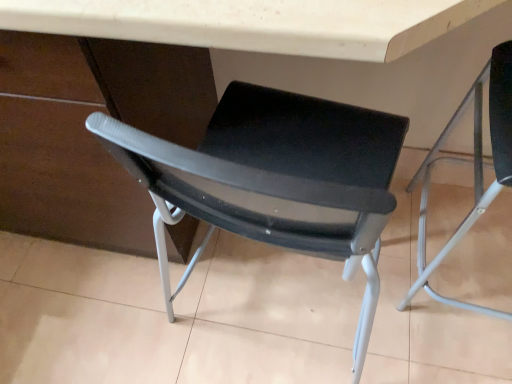
Describe the element at coordinates (474, 168) in the screenshot. I see `matte black chair at right, the first chair when ordered from right to left` at that location.

At what (x,y) coordinates should I click in order to perform the action: click on black mesh chair at center, which appears as the 1th chair when viewed from the left. Please return your answer as a coordinate pair (x, y). This screenshot has height=384, width=512. Looking at the image, I should click on (275, 180).

Locate an element on the screen. This screenshot has width=512, height=384. matte black chair at right, the first chair when ordered from right to left is located at coordinates (474, 168).

Is matte plastic table at center facing away from matte black chair at right, acting as the 2th chair starting from the left?

No, matte plastic table at center is not facing the opposite direction of matte black chair at right, acting as the 2th chair starting from the left.

Based on the photo, between matte plastic table at center and matte black chair at right, acting as the 2th chair starting from the left, which one has larger width?

matte plastic table at center is wider.

Would you say matte plastic table at center is inside or outside matte black chair at right, acting as the 2th chair starting from the left?

matte plastic table at center is spatially situated outside matte black chair at right, acting as the 2th chair starting from the left.

Who is smaller, matte plastic table at center or black mesh chair at center, which appears as the 1th chair when viewed from the left?

With smaller size is black mesh chair at center, which appears as the 1th chair when viewed from the left.

Is matte plastic table at center taller than black mesh chair at center, marked as the second chair in a right-to-left arrangement?

Indeed, matte plastic table at center has a greater height compared to black mesh chair at center, marked as the second chair in a right-to-left arrangement.

Between matte plastic table at center and black mesh chair at center, which appears as the 1th chair when viewed from the left, which one has smaller width?

matte plastic table at center.

From the image's perspective, is matte plastic table at center below black mesh chair at center, marked as the second chair in a right-to-left arrangement?

No, from the image's perspective, matte plastic table at center is not below black mesh chair at center, marked as the second chair in a right-to-left arrangement.

Is matte black chair at right, acting as the 2th chair starting from the left, smaller than black mesh chair at center, which appears as the 1th chair when viewed from the left?

Incorrect, matte black chair at right, acting as the 2th chair starting from the left, is not smaller in size than black mesh chair at center, which appears as the 1th chair when viewed from the left.

Is matte black chair at right, the first chair when ordered from right to left, turned away from black mesh chair at center, marked as the second chair in a right-to-left arrangement?

No, matte black chair at right, the first chair when ordered from right to left, is not facing the opposite direction of black mesh chair at center, marked as the second chair in a right-to-left arrangement.

Which object is further away from the camera, matte black chair at right, acting as the 2th chair starting from the left, or black mesh chair at center, marked as the second chair in a right-to-left arrangement?

black mesh chair at center, marked as the second chair in a right-to-left arrangement, is behind.

From the image's perspective, which is below, matte black chair at right, acting as the 2th chair starting from the left, or black mesh chair at center, which appears as the 1th chair when viewed from the left?

black mesh chair at center, which appears as the 1th chair when viewed from the left, from the image's perspective.

Which is in front, black mesh chair at center, which appears as the 1th chair when viewed from the left, or matte black chair at right, acting as the 2th chair starting from the left?

matte black chair at right, acting as the 2th chair starting from the left.

Identify the location of chair that is under the matte black chair at right, the first chair when ordered from right to left (from a real-world perspective). (275, 180).

Is black mesh chair at center, marked as the second chair in a right-to-left arrangement, aimed at matte black chair at right, acting as the 2th chair starting from the left?

No, black mesh chair at center, marked as the second chair in a right-to-left arrangement, is not oriented towards matte black chair at right, acting as the 2th chair starting from the left.

Is matte black chair at right, acting as the 2th chair starting from the left, inside the boundaries of matte plastic table at center, or outside?

matte black chair at right, acting as the 2th chair starting from the left, is spatially positioned inside matte plastic table at center.

Find the location of a particular element. chair that is the 1st one when counting downward from the matte plastic table at center (from the image's perspective) is located at coordinates (474, 168).

Visually, is matte black chair at right, the first chair when ordered from right to left, positioned to the left or to the right of matte plastic table at center?

Based on their positions, matte black chair at right, the first chair when ordered from right to left, is located to the right of matte plastic table at center.

How far apart are black mesh chair at center, marked as the second chair in a right-to-left arrangement, and matte plastic table at center?

black mesh chair at center, marked as the second chair in a right-to-left arrangement, is 9.38 inches away from matte plastic table at center.

From the image's perspective, is black mesh chair at center, marked as the second chair in a right-to-left arrangement, on matte plastic table at center?

No, from the image's perspective, black mesh chair at center, marked as the second chair in a right-to-left arrangement, is not over matte plastic table at center.

Is matte plastic table at center located within black mesh chair at center, marked as the second chair in a right-to-left arrangement?

No, matte plastic table at center is not surrounded by black mesh chair at center, marked as the second chair in a right-to-left arrangement.

In the scene shown: Between black mesh chair at center, which appears as the 1th chair when viewed from the left, and matte plastic table at center, which one appears on the right side from the viewer's perspective?

From the viewer's perspective, black mesh chair at center, which appears as the 1th chair when viewed from the left, appears more on the right side.

You are a GUI agent. You are given a task and a screenshot of the screen. Output one action in this format:
    pyautogui.click(x=<x>, y=<y>)
    Task: Click on the table above the matte black chair at right, acting as the 2th chair starting from the left (from the image's perspective)
    
    Given the screenshot: What is the action you would take?
    pyautogui.click(x=267, y=66)

The image size is (512, 384). In order to click on the 2nd chair behind the matte plastic table at center, starting your count from the anchor in this screenshot , I will do `click(275, 180)`.

When comparing their distances from matte plastic table at center, does matte black chair at right, the first chair when ordered from right to left, or black mesh chair at center, which appears as the 1th chair when viewed from the left, seem further?

matte black chair at right, the first chair when ordered from right to left, lies further to matte plastic table at center than the other object.

Which object lies nearer to the anchor point matte black chair at right, the first chair when ordered from right to left, black mesh chair at center, marked as the second chair in a right-to-left arrangement, or matte plastic table at center?

The object closer to matte black chair at right, the first chair when ordered from right to left, is matte plastic table at center.

Considering their positions, is matte black chair at right, the first chair when ordered from right to left, positioned further to black mesh chair at center, which appears as the 1th chair when viewed from the left, than matte plastic table at center?

Based on the image, matte black chair at right, the first chair when ordered from right to left, appears to be further to black mesh chair at center, which appears as the 1th chair when viewed from the left.

From the image, which object appears to be farther from matte black chair at right, acting as the 2th chair starting from the left, matte plastic table at center or black mesh chair at center, marked as the second chair in a right-to-left arrangement?

black mesh chair at center, marked as the second chair in a right-to-left arrangement, is positioned further to the anchor matte black chair at right, acting as the 2th chair starting from the left.

Looking at the image, which one is located further to black mesh chair at center, marked as the second chair in a right-to-left arrangement, matte plastic table at center or matte black chair at right, acting as the 2th chair starting from the left?

matte black chair at right, acting as the 2th chair starting from the left, lies further to black mesh chair at center, marked as the second chair in a right-to-left arrangement, than the other object.

Which object lies nearer to the anchor point matte plastic table at center, black mesh chair at center, marked as the second chair in a right-to-left arrangement, or matte black chair at right, the first chair when ordered from right to left?

Based on the image, black mesh chair at center, marked as the second chair in a right-to-left arrangement, appears to be nearer to matte plastic table at center.

Locate an element on the screen. chair situated between matte plastic table at center and matte black chair at right, acting as the 2th chair starting from the left, from left to right is located at coordinates (275, 180).